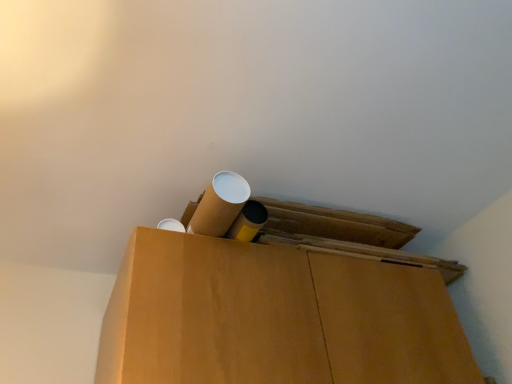
Question: In terms of height, does cardboard box at center, which appears as the first wide when ordered from the bottom, look taller or shorter compared to cardboard tube at upper center, which appears as the second wide when ordered from the bottom?

Choices:
 (A) tall
 (B) short

Answer: (A)

Question: Is cardboard box at center, the second wide when ordered from top to bottom, spatially inside cardboard tube at upper center, which appears as the second wide when ordered from the bottom, or outside of it?

Choices:
 (A) inside
 (B) outside

Answer: (B)

Question: From a real-world perspective, is cardboard box at center, the second wide when ordered from top to bottom, above or below cardboard tube at upper center, the first wide positioned from the top?

Choices:
 (A) above
 (B) below

Answer: (B)

Question: Considering the positions of cardboard tube at upper center, which appears as the second wide when ordered from the bottom, and cardboard box at center, which appears as the first wide when ordered from the bottom, in the image, is cardboard tube at upper center, which appears as the second wide when ordered from the bottom, wider or thinner than cardboard box at center, which appears as the first wide when ordered from the bottom,?

Choices:
 (A) wide
 (B) thin

Answer: (B)

Question: From the image's perspective, is cardboard tube at upper center, which appears as the second wide when ordered from the bottom, above or below cardboard box at center, the second wide when ordered from top to bottom?

Choices:
 (A) below
 (B) above

Answer: (B)

Question: From their relative heights in the image, would you say cardboard tube at upper center, the first wide positioned from the top, is taller or shorter than cardboard box at center, which appears as the first wide when ordered from the bottom?

Choices:
 (A) short
 (B) tall

Answer: (A)

Question: In the image, is cardboard tube at upper center, the first wide positioned from the top, positioned in front of or behind cardboard box at center, the second wide when ordered from top to bottom?

Choices:
 (A) behind
 (B) front

Answer: (A)